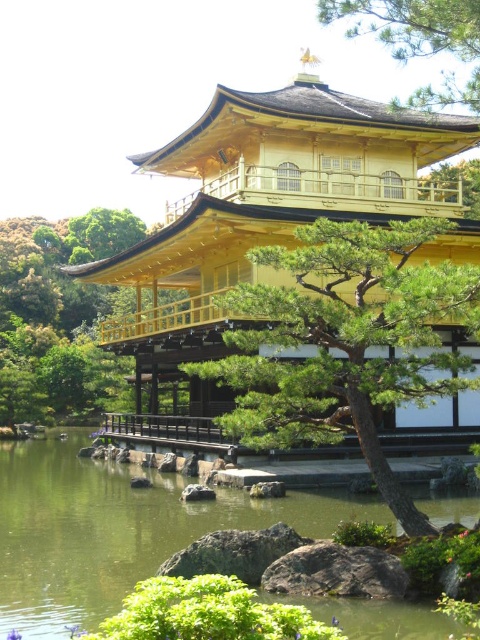
Question: Which object is positioned farthest from the gold polished wood palace at center?

Choices:
 (A) green textured tree at center
 (B) green textured tree at upper center
 (C) green matte tree at upper right

Answer: (C)

Question: Which point is closer to the camera?

Choices:
 (A) (356, 20)
 (B) (262, 148)
 (C) (453, 387)
 (D) (193, 534)

Answer: (C)

Question: Which point is closer to the camera taking this photo?

Choices:
 (A) tap(419, 90)
 (B) tap(455, 179)
 (C) tap(374, 179)

Answer: (A)

Question: Can you confirm if green liquid water at center is wider than green matte tree at upper right?

Choices:
 (A) yes
 (B) no

Answer: (A)

Question: Is gold polished wood palace at center thinner than green textured tree at upper center?

Choices:
 (A) yes
 (B) no

Answer: (B)

Question: Does gold polished wood palace at center lie behind green matte tree at upper right?

Choices:
 (A) yes
 (B) no

Answer: (B)